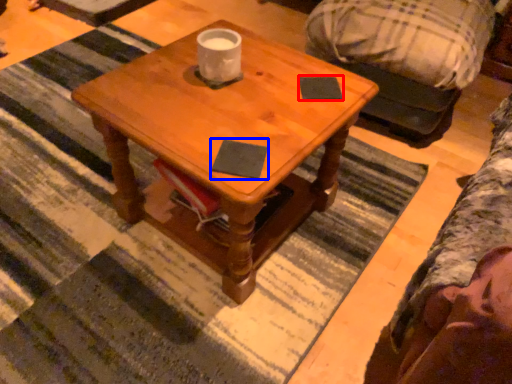
Question: Which object is further to the camera taking this photo, notepad (highlighted by a red box) or notepad (highlighted by a blue box)?

Choices:
 (A) notepad
 (B) notepad

Answer: (A)